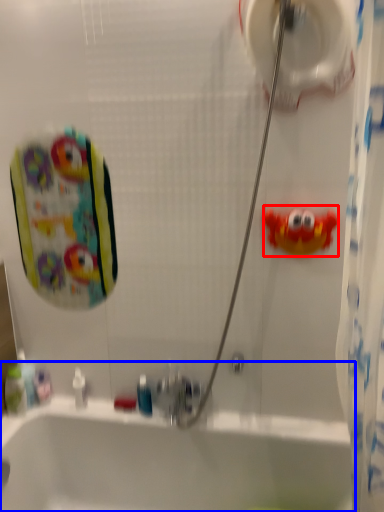
Question: Which object is closer to the camera taking this photo, toy (highlighted by a red box) or bathtub (highlighted by a blue box)?

Choices:
 (A) toy
 (B) bathtub

Answer: (B)